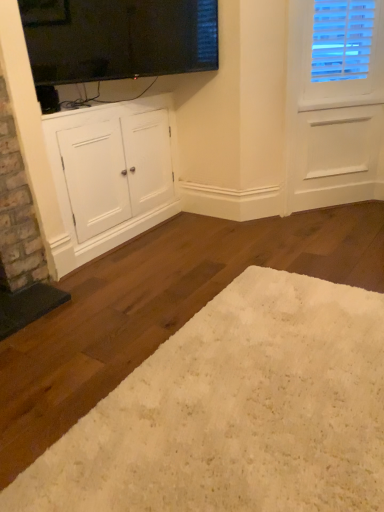
The height and width of the screenshot is (512, 384). Identify the location of black glass window screen at upper center. (118, 38).

What is the approximate height of black glass window screen at upper center?

black glass window screen at upper center is 20.39 inches in height.

Measure the distance between point (x=71, y=247) and camera.

The depth of point (x=71, y=247) is 7.68 feet.

You are a GUI agent. You are given a task and a screenshot of the screen. Output one action in this format:
    pyautogui.click(x=<x>, y=<y>)
    Task: Click on the black glass window screen at upper center
    This screenshot has height=512, width=384.
    Given the screenshot: What is the action you would take?
    pyautogui.click(x=118, y=38)

Does point (175, 373) lie behind point (74, 59)?

No, (175, 373) is in front of (74, 59).

From the picture: Between white shag rug at lower center and black glass window screen at upper center, which one has larger width?

white shag rug at lower center is wider.

Can you confirm if white shag rug at lower center is taller than black glass window screen at upper center?

In fact, white shag rug at lower center may be shorter than black glass window screen at upper center.

Is there a large distance between black glass window screen at upper center and white matte cabinet at lower left?

Actually, black glass window screen at upper center and white matte cabinet at lower left are a little close together.

Can you confirm if black glass window screen at upper center is bigger than white matte cabinet at lower left?

Incorrect, black glass window screen at upper center is not larger than white matte cabinet at lower left.

Which is correct: black glass window screen at upper center is inside white matte cabinet at lower left, or outside of it?

black glass window screen at upper center is located beyond the bounds of white matte cabinet at lower left.

Does black glass window screen at upper center turn towards white matte cabinet at lower left?

No, black glass window screen at upper center is not turned towards white matte cabinet at lower left.

Considering the points (52, 122) and (72, 1), which point is in front, point (52, 122) or point (72, 1)?

Positioned in front is point (72, 1).

Who is smaller, white matte cabinet at lower left or black glass window screen at upper center?

Smaller between the two is black glass window screen at upper center.

From a real-world perspective, does white matte cabinet at lower left stand above black glass window screen at upper center?

Incorrect, from a real-world perspective, white matte cabinet at lower left is lower than black glass window screen at upper center.

Which is in front, white matte cabinet at lower left or black glass window screen at upper center?

black glass window screen at upper center is closer to the camera.

What's the angular difference between white matte cabinet at lower left and white shag rug at lower center's facing directions?

The angular difference between white matte cabinet at lower left and white shag rug at lower center is 0.542 degrees.

From the image's perspective, is white matte cabinet at lower left above or below white shag rug at lower center?

white matte cabinet at lower left is situated higher than white shag rug at lower center in the image.

In the scene shown: Does white matte cabinet at lower left have a smaller size compared to white shag rug at lower center?

Actually, white matte cabinet at lower left might be larger than white shag rug at lower center.

Based on the photo, is white shag rug at lower center smaller than white matte cabinet at lower left?

Yes, white shag rug at lower center is smaller than white matte cabinet at lower left.

From their relative heights in the image, would you say white shag rug at lower center is taller or shorter than white matte cabinet at lower left?

Considering their sizes, white shag rug at lower center has less height than white matte cabinet at lower left.

Is white shag rug at lower center wider than white matte cabinet at lower left?

Correct, the width of white shag rug at lower center exceeds that of white matte cabinet at lower left.

What's the angular difference between black glass window screen at upper center and white shag rug at lower center's facing directions?

Result: The facing directions of black glass window screen at upper center and white shag rug at lower center are 22.6 degrees apart.

Consider the image. Is black glass window screen at upper center beside white shag rug at lower center?

There is a gap between black glass window screen at upper center and white shag rug at lower center.

Does black glass window screen at upper center have a larger size compared to white shag rug at lower center?

No, black glass window screen at upper center is not bigger than white shag rug at lower center.

You are a GUI agent. You are given a task and a screenshot of the screen. Output one action in this format:
    pyautogui.click(x=<x>, y=<y>)
    Task: Click on the plain below the black glass window screen at upper center (from a real-world perspective)
    
    Given the screenshot: What is the action you would take?
    pyautogui.click(x=235, y=412)

Image resolution: width=384 pixels, height=512 pixels. Find the location of `plain below the black glass window screen at upper center (from the image's perspective)`. plain below the black glass window screen at upper center (from the image's perspective) is located at coordinates (235, 412).

Locate an element on the screen. cabinetry on the left of the black glass window screen at upper center is located at coordinates (110, 175).

When comparing their distances from white shag rug at lower center, does black glass window screen at upper center or white matte cabinet at lower left seem closer?

white matte cabinet at lower left lies closer to white shag rug at lower center than the other object.

Based on their spatial positions, is white matte cabinet at lower left or black glass window screen at upper center further from white shag rug at lower center?

Among the two, black glass window screen at upper center is located further to white shag rug at lower center.

Considering their positions, is white shag rug at lower center positioned closer to white matte cabinet at lower left than black glass window screen at upper center?

black glass window screen at upper center is positioned closer to the anchor white matte cabinet at lower left.

Based on their spatial positions, is white shag rug at lower center or white matte cabinet at lower left closer to black glass window screen at upper center?

white matte cabinet at lower left is closer to black glass window screen at upper center.

Based on their spatial positions, is black glass window screen at upper center or white shag rug at lower center closer to white matte cabinet at lower left?

black glass window screen at upper center lies closer to white matte cabinet at lower left than the other object.

Looking at the image, which one is located closer to black glass window screen at upper center, white matte cabinet at lower left or white shag rug at lower center?

white matte cabinet at lower left.

Where is `cabinetry between black glass window screen at upper center and white shag rug at lower center vertically`? cabinetry between black glass window screen at upper center and white shag rug at lower center vertically is located at coordinates (110, 175).